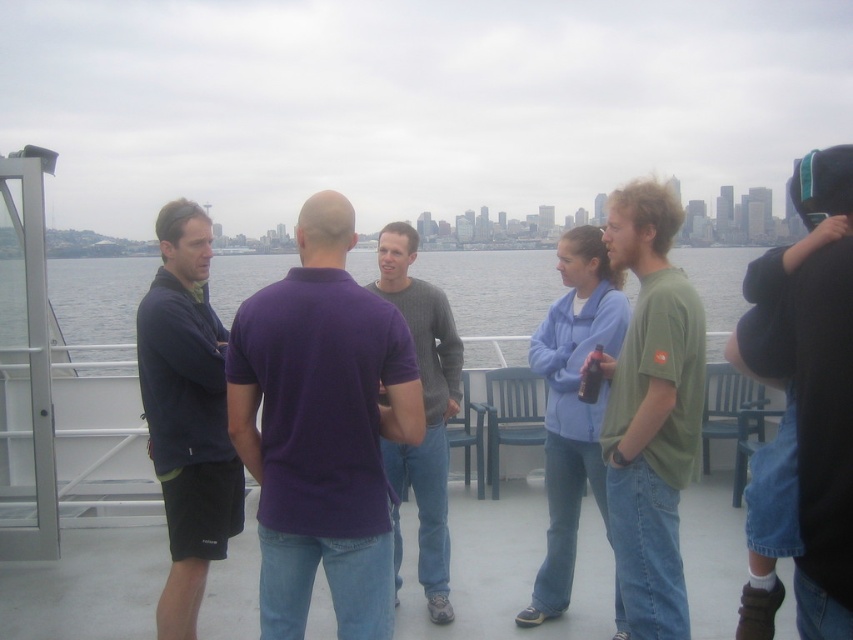
Question: Does purple cotton polo shirt at center have a smaller size compared to dark blue short sleeve shirt at left?

Choices:
 (A) yes
 (B) no

Answer: (A)

Question: Is dark blue short sleeve shirt at left below dark gray sweater at center?

Choices:
 (A) no
 (B) yes

Answer: (A)

Question: Which object is the farthest from the dark gray sweater at center?

Choices:
 (A) clear water at center
 (B) green cotton hoodie at upper right
 (C) green matte shirt at center
 (D) purple cotton polo shirt at center

Answer: (A)

Question: Considering the relative positions of purple cotton polo shirt at center and dark blue short sleeve shirt at left in the image provided, where is purple cotton polo shirt at center located with respect to dark blue short sleeve shirt at left?

Choices:
 (A) below
 (B) above

Answer: (A)

Question: Which object is closer to the camera taking this photo?

Choices:
 (A) dark blue short sleeve shirt at left
 (B) dark gray sweater at center

Answer: (B)

Question: Which of these objects is positioned farthest from the clear water at center?

Choices:
 (A) dark blue short sleeve shirt at left
 (B) purple cotton polo shirt at center

Answer: (A)